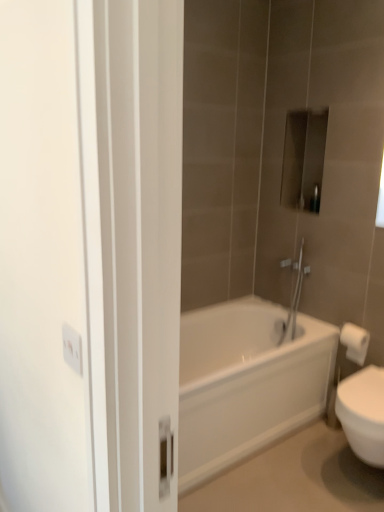
Question: Does white paper towel at right have a lesser width compared to metallic rectangular object at upper center?

Choices:
 (A) yes
 (B) no

Answer: (B)

Question: From the image's perspective, is white paper towel at right below metallic rectangular object at upper center?

Choices:
 (A) yes
 (B) no

Answer: (A)

Question: Is white paper towel at right shorter than metallic rectangular object at upper center?

Choices:
 (A) no
 (B) yes

Answer: (A)

Question: Is metallic rectangular object at upper center completely or partially inside white paper towel at right?

Choices:
 (A) no
 (B) yes

Answer: (A)

Question: From a real-world perspective, is white paper towel at right on top of metallic rectangular object at upper center?

Choices:
 (A) yes
 (B) no

Answer: (B)

Question: In the image, is white paper towel at right positioned in front of or behind metallic rectangular object at upper center?

Choices:
 (A) front
 (B) behind

Answer: (A)

Question: Considering the positions of white paper towel at right and metallic rectangular object at upper center in the image, is white paper towel at right bigger or smaller than metallic rectangular object at upper center?

Choices:
 (A) big
 (B) small

Answer: (A)

Question: Is point click(352, 326) closer or farther from the camera than point click(311, 200)?

Choices:
 (A) closer
 (B) farther

Answer: (A)

Question: Considering the positions of white paper towel at right and metallic rectangular object at upper center in the image, is white paper towel at right wider or thinner than metallic rectangular object at upper center?

Choices:
 (A) wide
 (B) thin

Answer: (A)

Question: From the image's perspective, relative to metallic rectangular object at upper center, is white glossy bathtub at center above or below?

Choices:
 (A) above
 (B) below

Answer: (B)

Question: Would you say white glossy bathtub at center is to the left or to the right of metallic rectangular object at upper center in the picture?

Choices:
 (A) left
 (B) right

Answer: (A)

Question: Is white glossy bathtub at center taller or shorter than metallic rectangular object at upper center?

Choices:
 (A) tall
 (B) short

Answer: (A)

Question: Considering the positions of white glossy bathtub at center and metallic rectangular object at upper center in the image, is white glossy bathtub at center bigger or smaller than metallic rectangular object at upper center?

Choices:
 (A) small
 (B) big

Answer: (B)

Question: Considering the positions of white paper towel at right and white glossy bathtub at center in the image, is white paper towel at right taller or shorter than white glossy bathtub at center?

Choices:
 (A) short
 (B) tall

Answer: (A)

Question: From the image's perspective, is white paper towel at right above or below white glossy bathtub at center?

Choices:
 (A) above
 (B) below

Answer: (A)